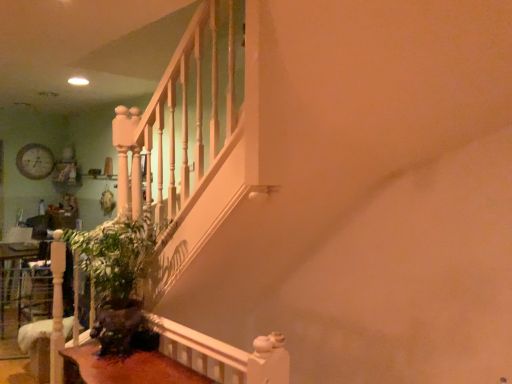
What is the approximate width of wooden clock at upper left?

The width of wooden clock at upper left is 6.50 centimeters.

The width and height of the screenshot is (512, 384). What do you see at coordinates (125, 368) in the screenshot?
I see `brown wooden table at lower left` at bounding box center [125, 368].

Measure the distance between green matte plant at lower left and camera.

They are 2.04 meters apart.

Where is `wooden clock at upper left`? wooden clock at upper left is located at coordinates (35, 161).

Can you confirm if brown wooden table at lower left is bigger than green matte plant at lower left?

No.

Considering the sizes of objects brown wooden table at lower left and green matte plant at lower left in the image provided, who is thinner, brown wooden table at lower left or green matte plant at lower left?

With smaller width is brown wooden table at lower left.

Which object is positioned more to the left, brown wooden table at lower left or green matte plant at lower left?

green matte plant at lower left.

Considering the relative sizes of brown wooden table at lower left and wooden clock at upper left in the image provided, is brown wooden table at lower left bigger than wooden clock at upper left?

Indeed, brown wooden table at lower left has a larger size compared to wooden clock at upper left.

Can you confirm if brown wooden table at lower left is positioned to the right of wooden clock at upper left?

Yes, brown wooden table at lower left is to the right of wooden clock at upper left.

Does brown wooden table at lower left touch wooden clock at upper left?

They are not placed beside each other.

From the image's perspective, is brown wooden table at lower left above or below wooden clock at upper left?

brown wooden table at lower left is situated lower than wooden clock at upper left in the image.

In the image, is green matte plant at lower left positioned in front of or behind brown wooden table at lower left?

Clearly, green matte plant at lower left is behind brown wooden table at lower left.

You are a GUI agent. You are given a task and a screenshot of the screen. Output one action in this format:
    pyautogui.click(x=<x>, y=<y>)
    Task: Click on the plant on the left of brown wooden table at lower left
    The image size is (512, 384).
    Given the screenshot: What is the action you would take?
    pyautogui.click(x=118, y=281)

From the image's perspective, is green matte plant at lower left on top of brown wooden table at lower left?

Yes, from the image's perspective, green matte plant at lower left is over brown wooden table at lower left.

Which of these two, green matte plant at lower left or brown wooden table at lower left, is smaller?

brown wooden table at lower left.

Can brown wooden table at lower left be found inside wooden clock at upper left?

No, wooden clock at upper left does not contain brown wooden table at lower left.

Does wooden clock at upper left have a larger size compared to brown wooden table at lower left?

Incorrect, wooden clock at upper left is not larger than brown wooden table at lower left.

Is wooden clock at upper left closer to camera compared to brown wooden table at lower left?

No, it is behind brown wooden table at lower left.

Which object is positioned more to the left, wooden clock at upper left or brown wooden table at lower left?

wooden clock at upper left is more to the left.

Between green matte plant at lower left and wooden clock at upper left, which one has smaller width?

wooden clock at upper left is thinner.

From a real-world perspective, is green matte plant at lower left beneath wooden clock at upper left?

Yes, from a real-world perspective, green matte plant at lower left is under wooden clock at upper left.

In the scene shown: Does green matte plant at lower left lie behind wooden clock at upper left?

No, it is not.

Does wooden clock at upper left lie behind green matte plant at lower left?

Yes, wooden clock at upper left is further from the viewer.

Can you confirm if wooden clock at upper left is wider than green matte plant at lower left?

No, wooden clock at upper left is not wider than green matte plant at lower left.

How different are the orientations of wooden clock at upper left and green matte plant at lower left in degrees?

The angular difference between wooden clock at upper left and green matte plant at lower left is 90.7 degrees.

This screenshot has height=384, width=512. What are the coordinates of `plant below the wooden clock at upper left (from the image's perspective)` in the screenshot? It's located at (118, 281).

Where is `table directly beneath the green matte plant at lower left (from a real-world perspective)`? The height and width of the screenshot is (384, 512). table directly beneath the green matte plant at lower left (from a real-world perspective) is located at coordinates (125, 368).

At what (x,y) coordinates should I click in order to perform the action: click on clock above the brown wooden table at lower left (from a real-world perspective). Please return your answer as a coordinate pair (x, y). Looking at the image, I should click on click(35, 161).

Which object lies nearer to the anchor point brown wooden table at lower left, green matte plant at lower left or wooden clock at upper left?

green matte plant at lower left lies closer to brown wooden table at lower left than the other object.

When comparing their distances from brown wooden table at lower left, does wooden clock at upper left or green matte plant at lower left seem further?

Based on the image, wooden clock at upper left appears to be further to brown wooden table at lower left.

Estimate the real-world distances between objects in this image. Which object is further from green matte plant at lower left, wooden clock at upper left or brown wooden table at lower left?

wooden clock at upper left.

Which object lies further to the anchor point green matte plant at lower left, brown wooden table at lower left or wooden clock at upper left?

wooden clock at upper left.

When comparing their distances from wooden clock at upper left, does brown wooden table at lower left or green matte plant at lower left seem closer?

green matte plant at lower left is positioned closer to the anchor wooden clock at upper left.

From the image, which object appears to be nearer to wooden clock at upper left, green matte plant at lower left or brown wooden table at lower left?

green matte plant at lower left lies closer to wooden clock at upper left than the other object.

At what (x,y) coordinates should I click in order to perform the action: click on plant between brown wooden table at lower left and wooden clock at upper left from front to back. Please return your answer as a coordinate pair (x, y). This screenshot has height=384, width=512. Looking at the image, I should click on [x=118, y=281].